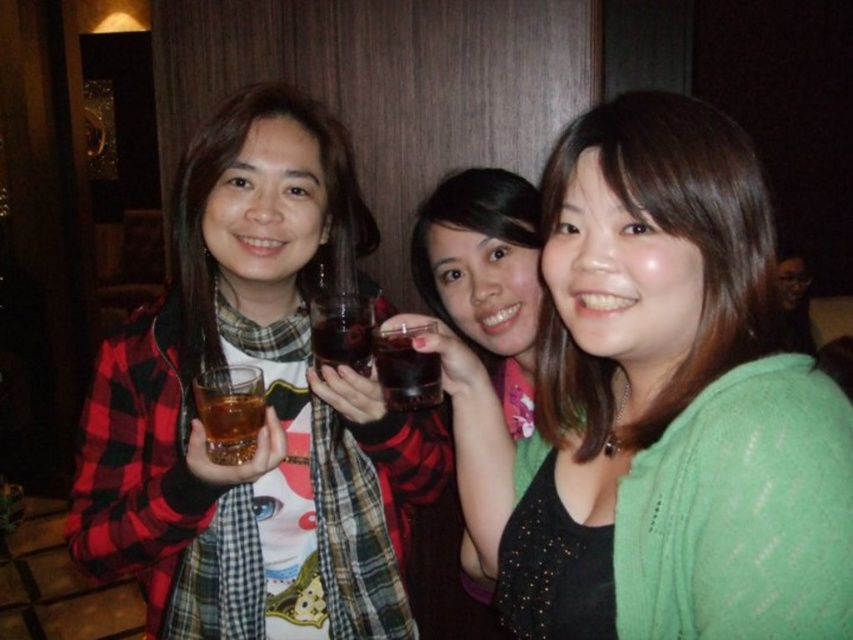
Question: Does matte black scarf at center have a greater width compared to translucent glass at center?

Choices:
 (A) yes
 (B) no

Answer: (A)

Question: From the image, what is the correct spatial relationship of matte black scarf at center in relation to matte black shirt at center?

Choices:
 (A) right
 (B) left

Answer: (B)

Question: Which of the following is the closest to the observer?

Choices:
 (A) green knitted sweater at center
 (B) translucent amber liquid at center
 (C) matte black shirt at center
 (D) green matte sweater at center

Answer: (A)

Question: Which point is closer to the camera?

Choices:
 (A) matte black scarf at center
 (B) translucent amber liquid at center
 (C) matte black shirt at center

Answer: (A)

Question: Is green knitted sweater at center bigger than matte black shirt at center?

Choices:
 (A) no
 (B) yes

Answer: (B)

Question: Which point is closer to the camera taking this photo?

Choices:
 (A) (265, 616)
 (B) (642, 252)

Answer: (B)